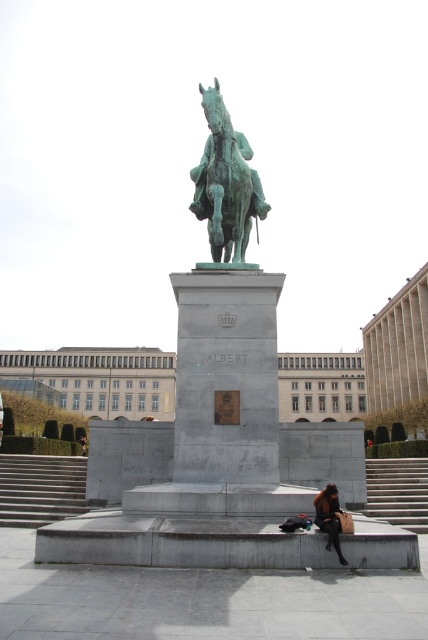
Question: Which of the following is the closest to the observer?

Choices:
 (A) brown leather jacket at lower center
 (B) gray concrete stairs at lower left
 (C) green patina statue at center

Answer: (A)

Question: Which object appears closest to the camera in this image?

Choices:
 (A) concrete stairs at lower right
 (B) green patina statue at center
 (C) gray concrete stairs at lower left
 (D) brown leather jacket at lower center

Answer: (D)

Question: Can you confirm if green patina statue at center is wider than concrete stairs at lower right?

Choices:
 (A) no
 (B) yes

Answer: (A)

Question: Which of the following is the farthest from the observer?

Choices:
 (A) green patina statue at center
 (B) gray concrete stairs at lower left

Answer: (B)

Question: Is green patina statue at center bigger than concrete stairs at lower right?

Choices:
 (A) no
 (B) yes

Answer: (A)

Question: Can you confirm if green patina statue at center is positioned below concrete stairs at lower right?

Choices:
 (A) yes
 (B) no

Answer: (B)